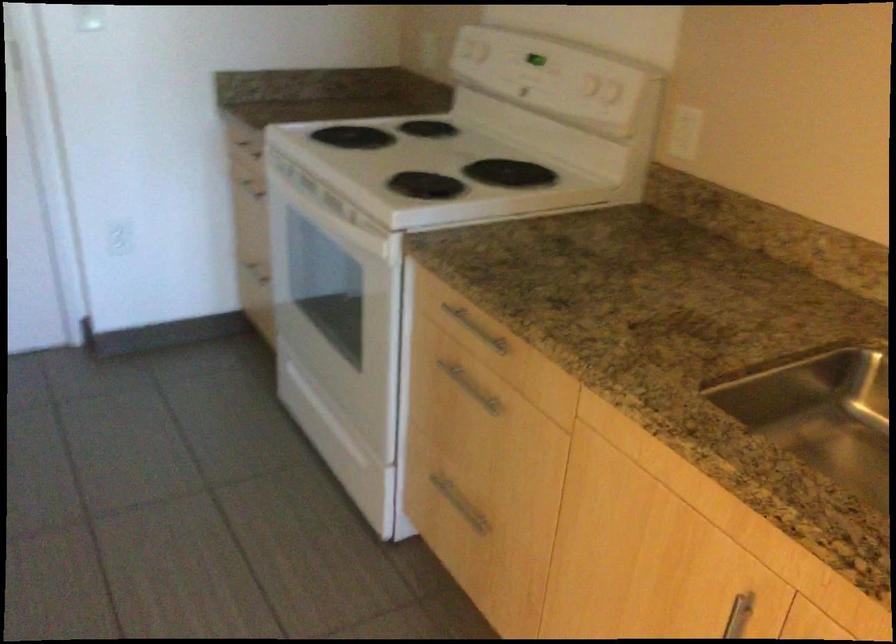
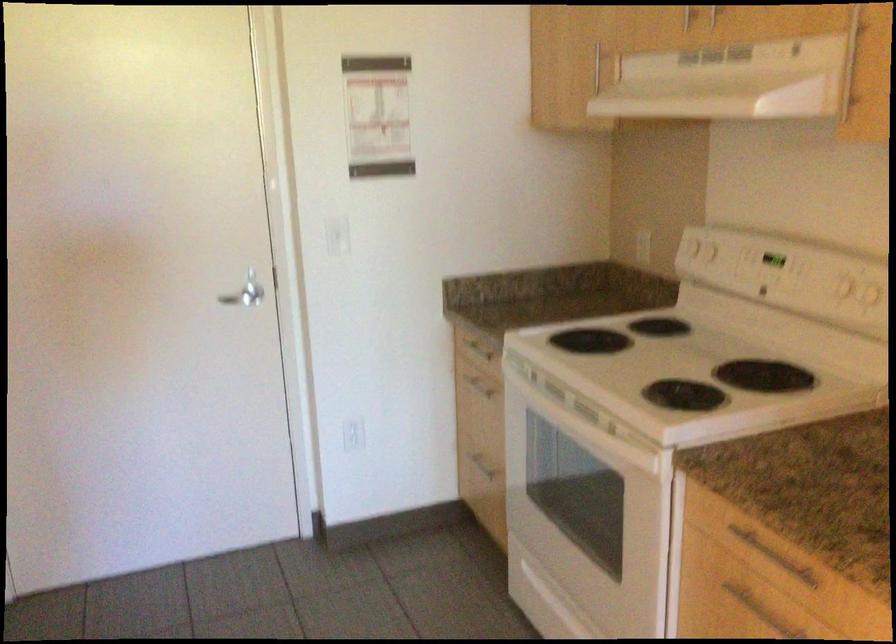
Locate, in the second image, the point that corresponds to pixel 254 192 in the first image.

(479, 384)